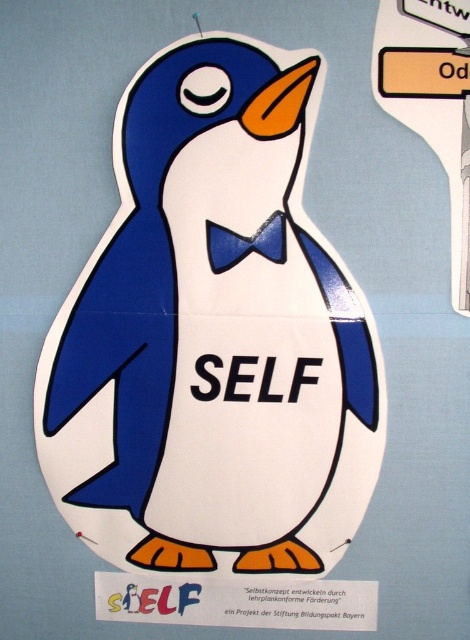
Which of these two, orange plastic sign at upper right or blue fabric bow tie at center, stands taller?

orange plastic sign at upper right

Can you confirm if orange plastic sign at upper right is positioned to the left of blue fabric bow tie at center?

Incorrect, orange plastic sign at upper right is not on the left side of blue fabric bow tie at center.

Image resolution: width=470 pixels, height=640 pixels. In order to click on orange plastic sign at upper right in this screenshot , I will do `click(431, 100)`.

Which is behind, point (179, 65) or point (445, 116)?

The point (179, 65) is behind.

Which is more to the left, matte paper penguin at center or orange plastic sign at upper right?

matte paper penguin at center

Is point (239, 563) positioned behind point (402, 88)?

Yes, point (239, 563) is farther from viewer.

The width and height of the screenshot is (470, 640). I want to click on matte paper penguin at center, so click(x=212, y=337).

Is matte paper penguin at center thinner than blue fabric bow tie at center?

Incorrect, matte paper penguin at center's width is not less than blue fabric bow tie at center's.

How much distance is there between matte paper penguin at center and blue fabric bow tie at center?

matte paper penguin at center is 8.45 inches from blue fabric bow tie at center.

Find the location of a particular element. The width and height of the screenshot is (470, 640). matte paper penguin at center is located at coordinates (212, 337).